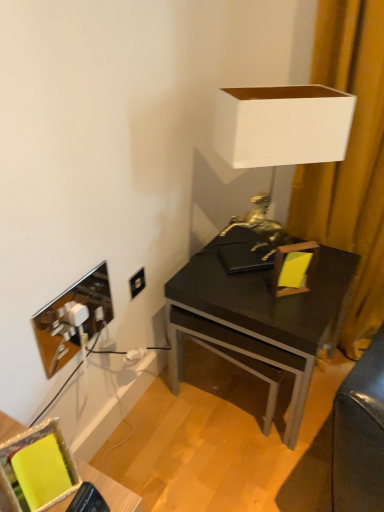
Question: Is white matte lampshade at upper right with metallic reflective picture frame at lower left, the 1th picture frame when ordered from top to bottom?

Choices:
 (A) yes
 (B) no

Answer: (B)

Question: Is metallic reflective picture frame at lower left, which is the 2th picture frame from bottom to top, completely or partially inside white matte lampshade at upper right?

Choices:
 (A) yes
 (B) no

Answer: (B)

Question: Can you confirm if white matte lampshade at upper right is thinner than metallic reflective picture frame at lower left, the second picture frame from the front?

Choices:
 (A) no
 (B) yes

Answer: (A)

Question: Considering the relative sizes of white matte lampshade at upper right and metallic reflective picture frame at lower left, marked as the 1th picture frame in a back-to-front arrangement, in the image provided, is white matte lampshade at upper right taller than metallic reflective picture frame at lower left, marked as the 1th picture frame in a back-to-front arrangement,?

Choices:
 (A) no
 (B) yes

Answer: (B)

Question: From the image's perspective, does white matte lampshade at upper right appear higher than metallic reflective picture frame at lower left, marked as the 1th picture frame in a back-to-front arrangement?

Choices:
 (A) no
 (B) yes

Answer: (B)

Question: Would you say white matte lampshade at upper right is outside metallic reflective picture frame at lower left, which is the 2th picture frame from bottom to top?

Choices:
 (A) no
 (B) yes

Answer: (B)

Question: Would you consider yellow fabric picture frame at lower left, positioned as the 1th picture frame in front-to-back order, to be distant from white matte lampshade at upper right?

Choices:
 (A) no
 (B) yes

Answer: (A)

Question: Can you confirm if yellow fabric picture frame at lower left, which is counted as the 1th picture frame, starting from the bottom, is smaller than white matte lampshade at upper right?

Choices:
 (A) no
 (B) yes

Answer: (B)

Question: Would you say yellow fabric picture frame at lower left, positioned as the 1th picture frame in front-to-back order, contains white matte lampshade at upper right?

Choices:
 (A) no
 (B) yes

Answer: (A)

Question: Is yellow fabric picture frame at lower left, the 2th picture frame when ordered from back to front, further to camera compared to white matte lampshade at upper right?

Choices:
 (A) no
 (B) yes

Answer: (A)

Question: Is yellow fabric picture frame at lower left, positioned as the 1th picture frame in front-to-back order, located outside white matte lampshade at upper right?

Choices:
 (A) yes
 (B) no

Answer: (A)

Question: Is yellow fabric picture frame at lower left, which ranks as the second picture frame in top-to-bottom order, positioned with its back to white matte lampshade at upper right?

Choices:
 (A) no
 (B) yes

Answer: (A)

Question: Is the position of yellow fabric picture frame at lower left, positioned as the 1th picture frame in front-to-back order, less distant than that of black plastic power outlet at lower left?

Choices:
 (A) no
 (B) yes

Answer: (B)